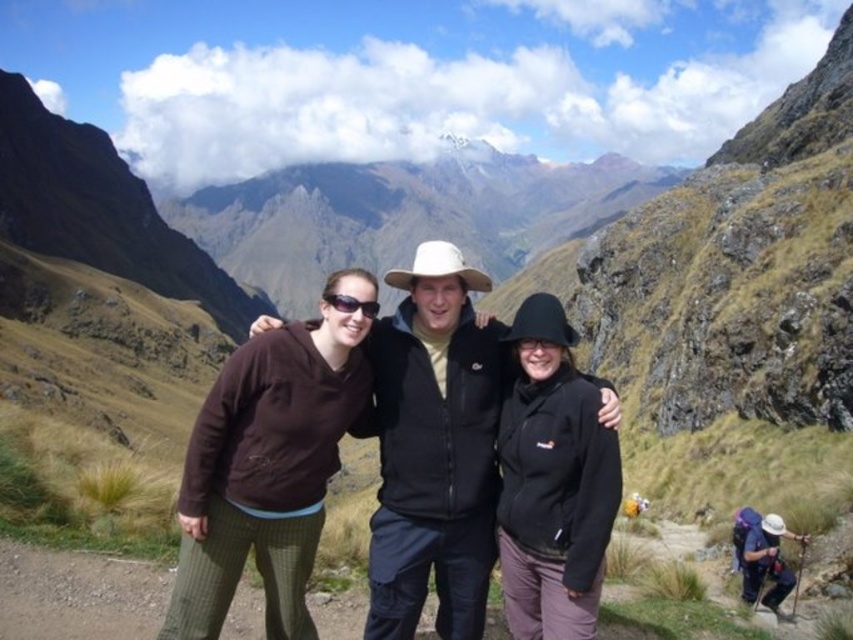
You are standing at the viewpoint and want to reach the point marked as point (x=183, y=524). If your walking speed is 1.5 meters per second, how many seconds will it take you to reach that point?

The distance between you and point (x=183, y=524) is 30.16 meters. At a speed of 1.5 meters per second, it will take approximately 20.11 seconds to reach the point.

You are a hiker who wants to take a photo of the black fleece jacket at center from a safe distance. What is the minimum distance you should maintain to ensure the jacket is clearly visible in your camera lens?

The black fleece jacket at center is 97.56 feet away from the viewer. To ensure the jacket is clearly visible, you should maintain a minimum distance of at least 97.56 feet.

You are a hiker trying to locate your friend who is wearing a brown fleece at center. You are standing at the origin point of the coordinate system. What are the coordinates where you should look to find your friend?

The coordinates for the brown fleece at center are at point [265,472].